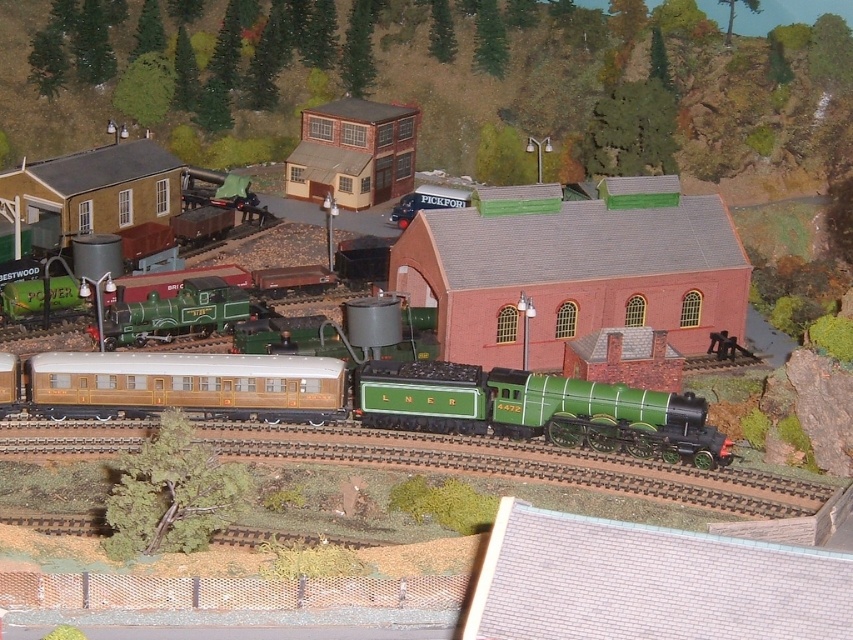
Who is more forward, (645, 406) or (273, 358)?

Point (645, 406)

Does matte green locomotive at center appear on the left side of matte gold passenger car at center?

In fact, matte green locomotive at center is to the right of matte gold passenger car at center.

Locate an element on the screen. Image resolution: width=853 pixels, height=640 pixels. matte green locomotive at center is located at coordinates (537, 410).

Locate an element on the screen. This screenshot has height=640, width=853. matte green locomotive at center is located at coordinates (537, 410).

Does matte green locomotive at center have a larger size compared to green metal train track at center?

Indeed, matte green locomotive at center has a larger size compared to green metal train track at center.

Who is more forward, (700, 468) or (463, 468)?

Positioned in front is point (463, 468).

The height and width of the screenshot is (640, 853). What are the coordinates of `matte green locomotive at center` in the screenshot? It's located at (537, 410).

Who is positioned more to the left, green metal train track at center or matte gold passenger car at center?

matte gold passenger car at center is more to the left.

Between point (613, 490) and point (189, 384), which one is positioned in front?

Positioned in front is point (613, 490).

Identify the location of green metal train track at center. This screenshot has width=853, height=640. pos(521,465).